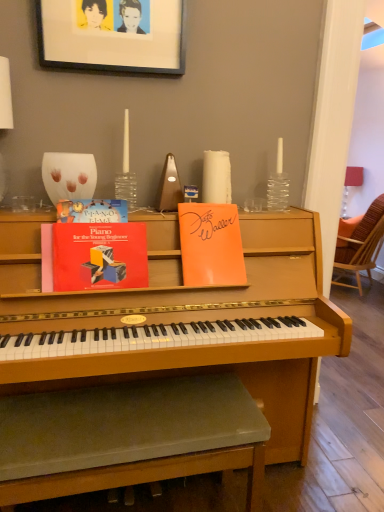
Question: Considering the relative sizes of hardcover book at upper left, acting as the 1th paperback book starting from the left, and black matte picture frame at upper center in the image provided, is hardcover book at upper left, acting as the 1th paperback book starting from the left, bigger than black matte picture frame at upper center?

Choices:
 (A) yes
 (B) no

Answer: (B)

Question: Is hardcover book at upper left, which is counted as the third paperback book, starting from the right, directly adjacent to black matte picture frame at upper center?

Choices:
 (A) yes
 (B) no

Answer: (B)

Question: Considering the relative positions of hardcover book at upper left, acting as the 1th paperback book starting from the left, and black matte picture frame at upper center in the image provided, is hardcover book at upper left, acting as the 1th paperback book starting from the left, to the right of black matte picture frame at upper center from the viewer's perspective?

Choices:
 (A) yes
 (B) no

Answer: (B)

Question: Is hardcover book at upper left, acting as the 1th paperback book starting from the left, oriented away from black matte picture frame at upper center?

Choices:
 (A) yes
 (B) no

Answer: (B)

Question: Is hardcover book at upper left, which is counted as the third paperback book, starting from the right, thinner than black matte picture frame at upper center?

Choices:
 (A) no
 (B) yes

Answer: (A)

Question: Based on their sizes in the image, would you say hardcover book at upper left, acting as the 1th paperback book starting from the left, is bigger or smaller than wooden woven chair at right?

Choices:
 (A) big
 (B) small

Answer: (B)

Question: In terms of width, does hardcover book at upper left, which is counted as the third paperback book, starting from the right, look wider or thinner when compared to wooden woven chair at right?

Choices:
 (A) thin
 (B) wide

Answer: (A)

Question: Is hardcover book at upper left, acting as the 1th paperback book starting from the left, in front of or behind wooden woven chair at right in the image?

Choices:
 (A) front
 (B) behind

Answer: (A)

Question: Does point (125, 209) appear closer or farther from the camera than point (370, 278)?

Choices:
 (A) closer
 (B) farther

Answer: (A)

Question: Based on their sizes in the image, would you say green fabric music stool at lower center is bigger or smaller than wooden woven chair at right?

Choices:
 (A) big
 (B) small

Answer: (B)

Question: Does point (175, 448) appear closer or farther from the camera than point (349, 267)?

Choices:
 (A) farther
 (B) closer

Answer: (B)

Question: Based on their positions, is green fabric music stool at lower center located to the left or right of wooden woven chair at right?

Choices:
 (A) right
 (B) left

Answer: (B)

Question: From a real-world perspective, is green fabric music stool at lower center positioned above or below wooden woven chair at right?

Choices:
 (A) above
 (B) below

Answer: (B)

Question: Is point (370, 231) positioned closer to the camera than point (210, 229)?

Choices:
 (A) farther
 (B) closer

Answer: (A)

Question: In terms of size, does wooden woven chair at right appear bigger or smaller than orange paper at upper center, the 3th paperback book when ordered from left to right?

Choices:
 (A) small
 (B) big

Answer: (B)